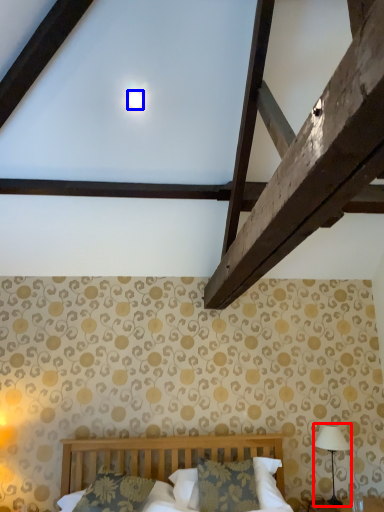
Question: Among these objects, which one is farthest to the camera, table lamp (highlighted by a red box) or moonlight (highlighted by a blue box)?

Choices:
 (A) table lamp
 (B) moonlight

Answer: (A)